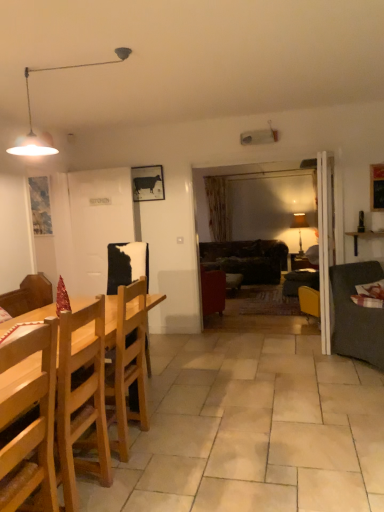
Question: Is dark brown leather couch at center, which is counted as the 1th studio couch, starting from the back, wider than metallic pendant light at upper left, arranged as the second lamp when viewed from the back?

Choices:
 (A) no
 (B) yes

Answer: (B)

Question: From a real-world perspective, is dark brown leather couch at center, which is counted as the 1th studio couch, starting from the back, located beneath metallic pendant light at upper left, which ranks as the 2th lamp in right-to-left order?

Choices:
 (A) yes
 (B) no

Answer: (A)

Question: Is dark brown leather couch at center, which is counted as the 1th studio couch, starting from the back, facing towards metallic pendant light at upper left, placed as the 2th lamp when sorted from bottom to top?

Choices:
 (A) yes
 (B) no

Answer: (B)

Question: From a real-world perspective, is dark brown leather couch at center, the 2th studio couch from the front, located higher than metallic pendant light at upper left, which ranks as the 2th lamp in right-to-left order?

Choices:
 (A) yes
 (B) no

Answer: (B)

Question: Considering the relative positions of dark brown leather couch at center, the 2th studio couch from the front, and metallic pendant light at upper left, the first lamp viewed from the left, in the image provided, is dark brown leather couch at center, the 2th studio couch from the front, to the right of metallic pendant light at upper left, the first lamp viewed from the left, from the viewer's perspective?

Choices:
 (A) no
 (B) yes

Answer: (B)

Question: Is dark brown leather couch at center, the 2th studio couch from the front, behind metallic pendant light at upper left, which ranks as the 2th lamp in right-to-left order?

Choices:
 (A) yes
 (B) no

Answer: (A)

Question: Is light wood chair at left, which is the second chair from back to front, taller than dark brown leather couch at center, which is counted as the 1th studio couch, starting from the back?

Choices:
 (A) no
 (B) yes

Answer: (B)

Question: Is dark brown leather couch at center, the 2th studio couch from the front, a part of light wood chair at left, which is the second chair from back to front?

Choices:
 (A) no
 (B) yes

Answer: (A)

Question: Can you confirm if light wood chair at left, positioned as the 1th chair in front-to-back order, is shorter than dark brown leather couch at center, which is counted as the 1th studio couch, starting from the back?

Choices:
 (A) no
 (B) yes

Answer: (A)

Question: Is light wood chair at left, positioned as the 1th chair in front-to-back order, wider than dark brown leather couch at center, the 2th studio couch from the front?

Choices:
 (A) no
 (B) yes

Answer: (A)

Question: Is light wood chair at left, which is the second chair from back to front, oriented towards dark brown leather couch at center, which is counted as the 1th studio couch, starting from the back?

Choices:
 (A) no
 (B) yes

Answer: (A)

Question: From a real-world perspective, is light wood chair at left, positioned as the 1th chair in front-to-back order, below dark brown leather couch at center, which is counted as the 1th studio couch, starting from the back?

Choices:
 (A) yes
 (B) no

Answer: (B)

Question: Can you confirm if metallic pendant light at upper left, arranged as the second lamp when viewed from the back, is positioned to the right of dark brown leather couch at center, which is counted as the 1th studio couch, starting from the back?

Choices:
 (A) no
 (B) yes

Answer: (A)